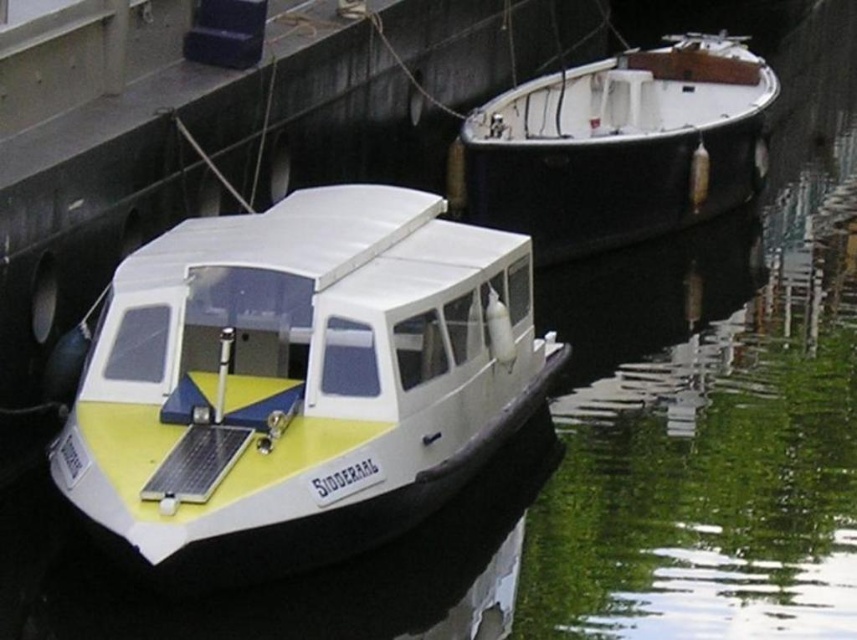
How much distance is there between yellow matte boat at center and black polished wood boat at upper right?

7.56 meters

Which is above, yellow matte boat at center or black polished wood boat at upper right?

Positioned higher is black polished wood boat at upper right.

Is point (450, 387) farther from camera compared to point (542, 248)?

That is False.

Find the location of a particular element. yellow matte boat at center is located at coordinates (297, 381).